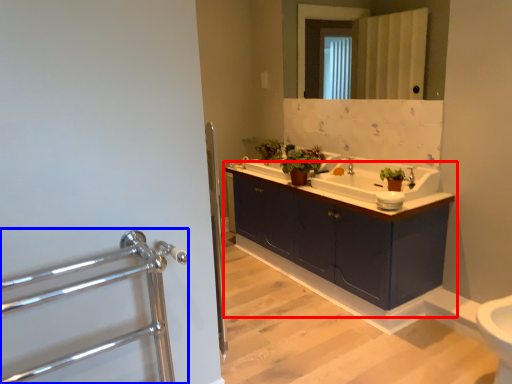
Question: Which of the following is the closest to the observer, bathroom cabinet (highlighted by a red box) or steel (highlighted by a blue box)?

Choices:
 (A) bathroom cabinet
 (B) steel

Answer: (B)